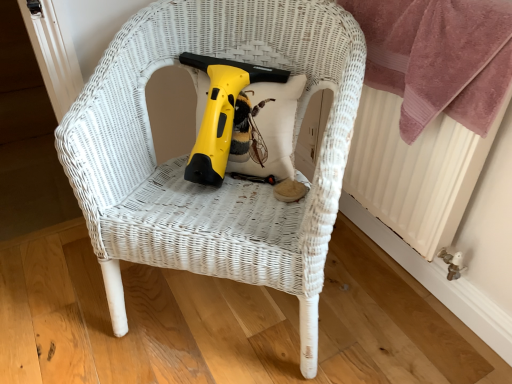
Question: Relative to pink plush towel at upper right, is white wicker chair at center in front or behind?

Choices:
 (A) front
 (B) behind

Answer: (A)

Question: Is white wicker chair at center taller or shorter than pink plush towel at upper right?

Choices:
 (A) tall
 (B) short

Answer: (A)

Question: Which object is the farthest from the white textured radiator at right?

Choices:
 (A) white wicker chair at center
 (B) yellow plastic electric drill at center
 (C) pink plush towel at upper right

Answer: (B)

Question: Based on their relative distances, which object is nearer to the yellow plastic electric drill at center?

Choices:
 (A) pink plush towel at upper right
 (B) white textured radiator at right
 (C) white wicker chair at center

Answer: (C)